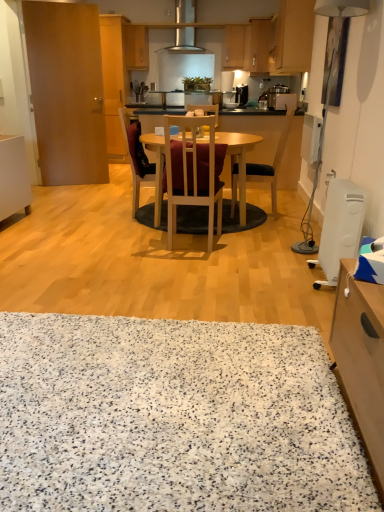
Question: Should I look upward or downward to see black plastic coffee machine at upper center?

Choices:
 (A) up
 (B) down

Answer: (A)

Question: From a real-world perspective, is wooden cabinet at left, placed as the fourth cabinetry when sorted from back to front, under black fabric chair at center, the third chair when ordered from left to right?

Choices:
 (A) yes
 (B) no

Answer: (B)

Question: Is wooden cabinet at left, positioned as the fifth cabinetry in right-to-left order, positioned with its back to black fabric chair at center, the third chair when ordered from left to right?

Choices:
 (A) no
 (B) yes

Answer: (A)

Question: Is wooden cabinet at left, placed as the fourth cabinetry when sorted from back to front, to the left of black fabric chair at center, acting as the 1th chair starting from the right, from the viewer's perspective?

Choices:
 (A) no
 (B) yes

Answer: (B)

Question: Can you confirm if wooden cabinet at left, positioned as the fifth cabinetry in right-to-left order, is bigger than black fabric chair at center, the third chair when ordered from left to right?

Choices:
 (A) yes
 (B) no

Answer: (A)

Question: Does wooden cabinet at left, the second cabinetry in the left-to-right sequence, have a smaller size compared to black fabric chair at center, acting as the 1th chair starting from the right?

Choices:
 (A) yes
 (B) no

Answer: (B)

Question: From the image's perspective, is wooden cabinet at left, placed as the fourth cabinetry when sorted from back to front, above black fabric chair at center, acting as the 1th chair starting from the right?

Choices:
 (A) no
 (B) yes

Answer: (B)

Question: Can you confirm if white plastic lamp at right is shorter than white glossy plate at center?

Choices:
 (A) no
 (B) yes

Answer: (A)

Question: Is white plastic lamp at right to the right of white glossy plate at center from the viewer's perspective?

Choices:
 (A) yes
 (B) no

Answer: (A)

Question: Is white plastic lamp at right positioned with its back to white glossy plate at center?

Choices:
 (A) no
 (B) yes

Answer: (A)

Question: Does white plastic lamp at right come in front of white glossy plate at center?

Choices:
 (A) no
 (B) yes

Answer: (B)

Question: Is white plastic lamp at right smaller than white glossy plate at center?

Choices:
 (A) yes
 (B) no

Answer: (B)

Question: Can you confirm if white plastic lamp at right is taller than white glossy plate at center?

Choices:
 (A) no
 (B) yes

Answer: (B)

Question: Does wooden cabinet at upper right, the second cabinetry positioned from the front, have a lesser height compared to white plastic heater at lower right, the 2th appliance viewed from the top?

Choices:
 (A) yes
 (B) no

Answer: (B)